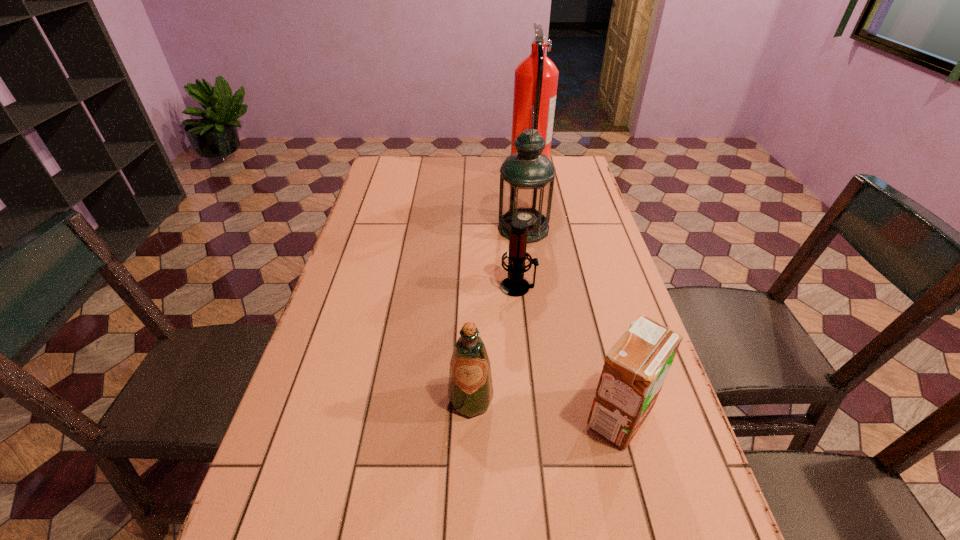
At what (x,y) coordinates should I click in order to perform the action: click on vacant space that satisfies the following two spatial constraints: 1. at the nozzle of the fire extinguisher; 2. on the front side of the microphone. Please return your answer as a coordinate pair (x, y). Looking at the image, I should click on (550, 287).

This screenshot has width=960, height=540. In order to click on free space that satisfies the following two spatial constraints: 1. at the nozzle of the tallest object; 2. on the front-facing side of the olive oil in this screenshot , I will do `click(570, 400)`.